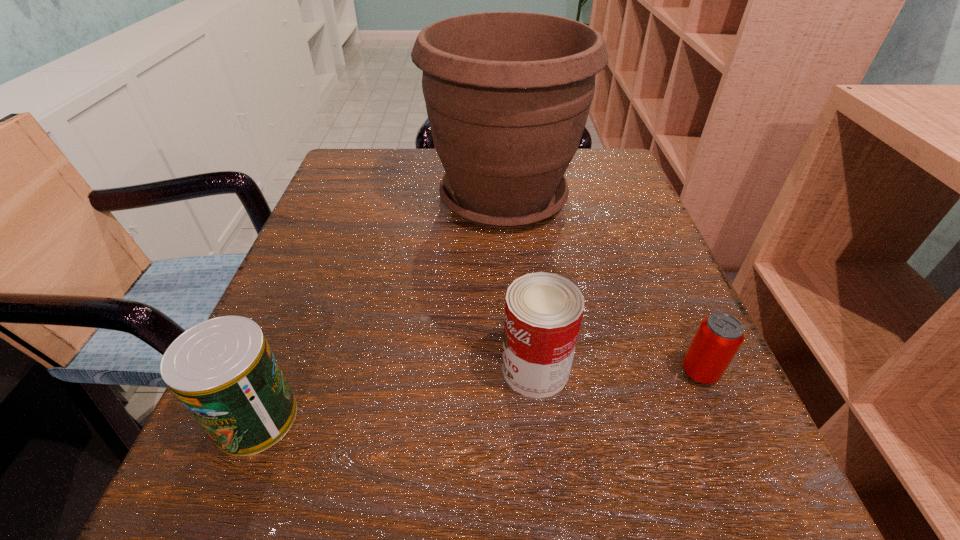
Locate an element on the screen. This screenshot has height=540, width=960. free space at the far left corner of the desktop is located at coordinates (359, 200).

Where is `empty location between the second can from right to left and the leftmost object`? Image resolution: width=960 pixels, height=540 pixels. empty location between the second can from right to left and the leftmost object is located at coordinates (396, 394).

The image size is (960, 540). Identify the location of vacant area that lies between the leftmost object and the rightmost can. (478, 395).

Image resolution: width=960 pixels, height=540 pixels. Find the location of `vacant point located between the leftmost object and the second can from left to right`. vacant point located between the leftmost object and the second can from left to right is located at coordinates (396, 394).

I want to click on free space that is in between the leftmost can and the tallest object, so click(x=379, y=308).

Image resolution: width=960 pixels, height=540 pixels. What are the coordinates of `free spot between the leftmost object and the farthest object` in the screenshot? It's located at (379, 308).

This screenshot has height=540, width=960. Find the location of `free space between the leftmost can and the shortest can`. free space between the leftmost can and the shortest can is located at coordinates (478, 395).

This screenshot has width=960, height=540. Find the location of `free space between the second can from right to left and the rightmost can`. free space between the second can from right to left and the rightmost can is located at coordinates (617, 370).

You are a GUI agent. You are given a task and a screenshot of the screen. Output one action in this format:
    pyautogui.click(x=<x>, y=<y>)
    Task: Click on the vacant area that lies between the rightmost object and the leftmost object
    This screenshot has width=960, height=540.
    Given the screenshot: What is the action you would take?
    pyautogui.click(x=478, y=395)

Locate an element on the screen. vacant area between the second can from right to left and the shortest can is located at coordinates (617, 370).